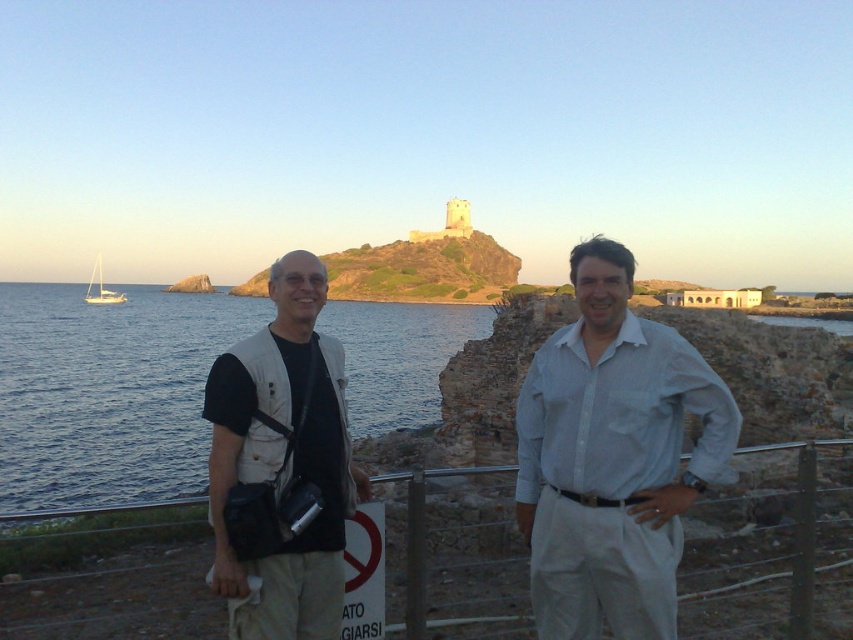
Question: Which of the following is the closest to the observer?

Choices:
 (A) beige fabric vest at left
 (B) metal/rustic rail at center
 (C) blue water at left
 (D) light beige vest at center

Answer: (B)

Question: Among these objects, which one is farthest from the camera?

Choices:
 (A) white cotton shirt at center
 (B) blue water at left
 (C) beige fabric vest at left

Answer: (B)

Question: Does light beige vest at center appear over blue water at left?

Choices:
 (A) no
 (B) yes

Answer: (A)

Question: Which point is closer to the camera taking this photo?

Choices:
 (A) [x=672, y=600]
 (B) [x=65, y=513]

Answer: (A)

Question: Is blue water at left above beige fabric vest at left?

Choices:
 (A) no
 (B) yes

Answer: (B)

Question: Can you confirm if beige fabric vest at left is bigger than metal/rustic rail at center?

Choices:
 (A) no
 (B) yes

Answer: (A)